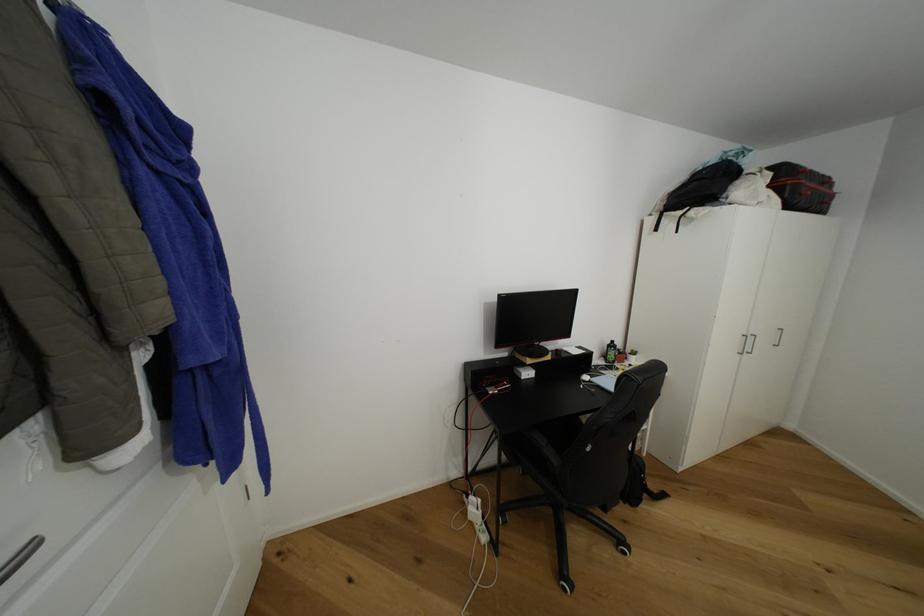
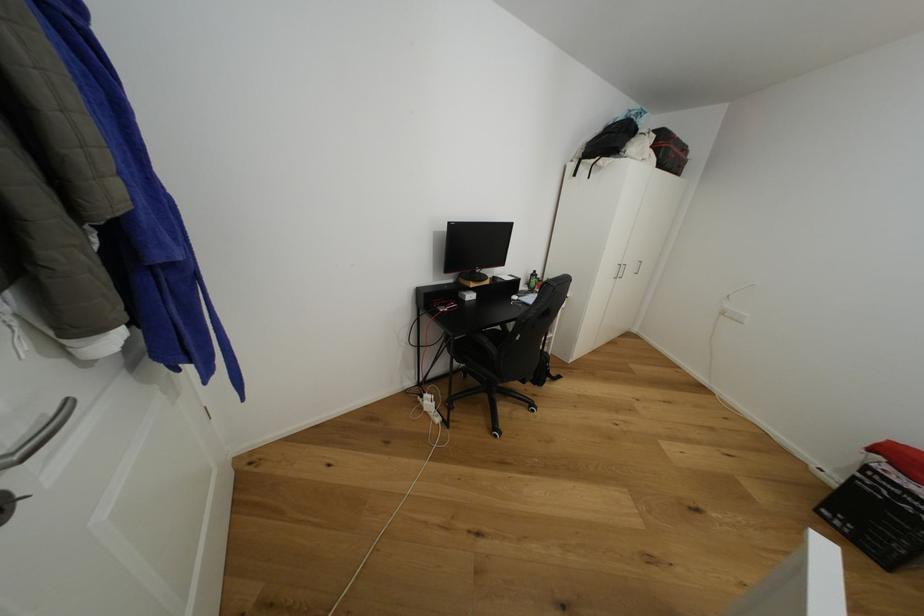
Find the pixel in the second image that matches pixel 37 548 in the first image.

(75, 405)